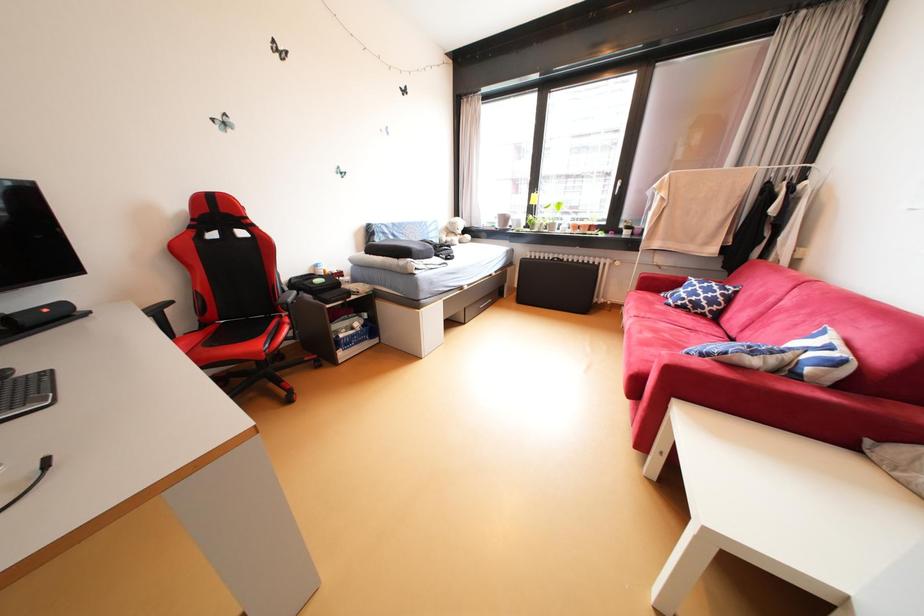
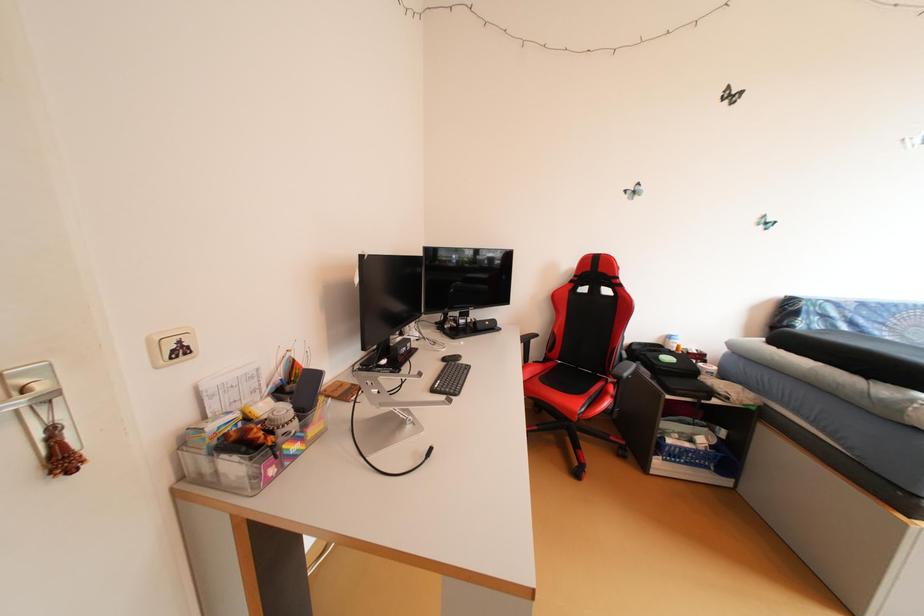
Question: How did the camera likely rotate?

Choices:
 (A) Left
 (B) Right
 (C) Up
 (D) Down

Answer: (A)